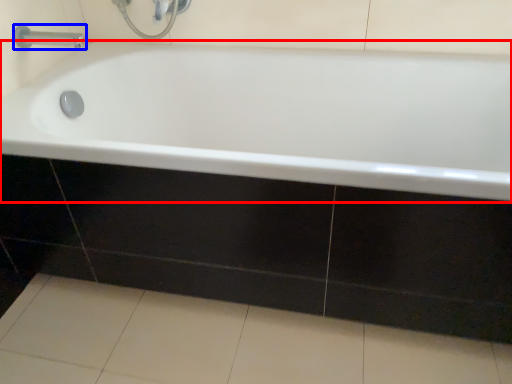
Question: Which object appears closest to the camera in this image, bathtub (highlighted by a red box) or tap (highlighted by a blue box)?

Choices:
 (A) bathtub
 (B) tap

Answer: (A)